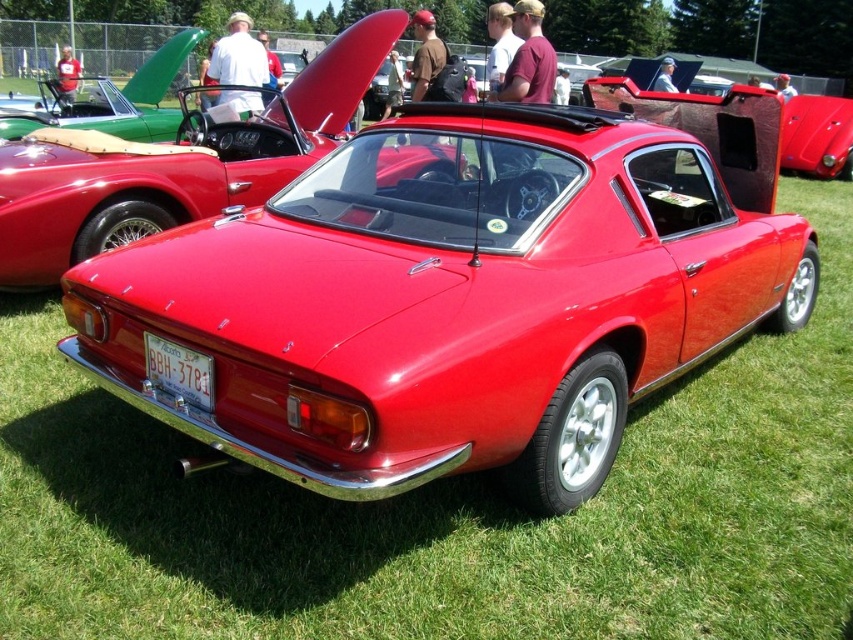
Question: Can you confirm if glossy red car at center is wider than glossy red convertible at center?

Choices:
 (A) yes
 (B) no

Answer: (B)

Question: Which point is closer to the camera taking this photo?

Choices:
 (A) (834, 115)
 (B) (165, 364)

Answer: (B)

Question: Where is glossy red car at center located in relation to glossy red convertible at center in the image?

Choices:
 (A) below
 (B) above

Answer: (A)

Question: Which point is closer to the camera taking this photo?

Choices:
 (A) pos(215,202)
 (B) pos(814,138)
 (C) pos(173,381)

Answer: (C)

Question: Which point is closer to the camera?

Choices:
 (A) glossy red car at center
 (B) white plastic license plate at lower center
 (C) glossy red convertible at center

Answer: (B)

Question: Is glossy red car at center bigger than white plastic license plate at lower center?

Choices:
 (A) no
 (B) yes

Answer: (B)